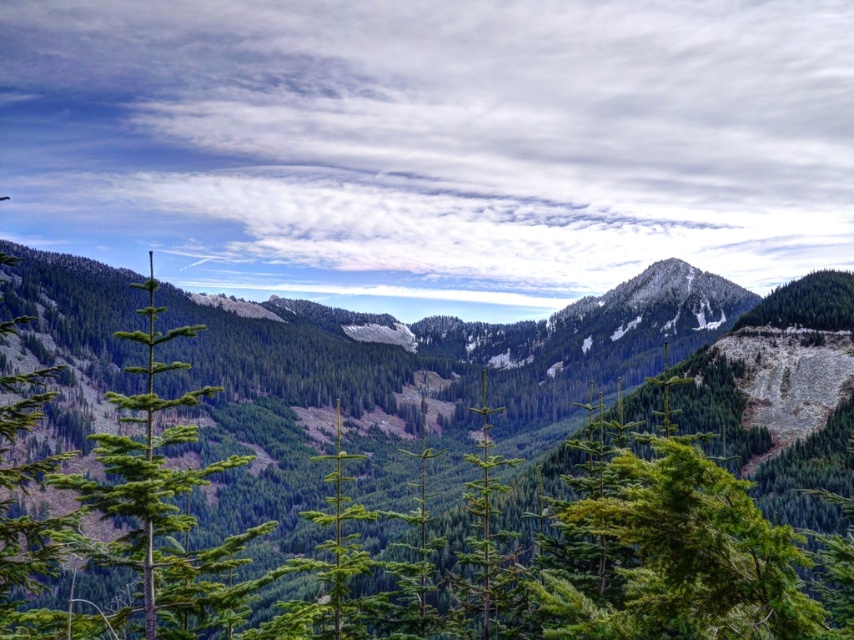
Question: Can you confirm if green matte tree at center is bigger than green needle-like tree at left?

Choices:
 (A) yes
 (B) no

Answer: (B)

Question: Is green matte tree at center to the left of green needle-like tree at left from the viewer's perspective?

Choices:
 (A) yes
 (B) no

Answer: (B)

Question: Which point is farther to the camera?

Choices:
 (A) green needle-like tree at left
 (B) green matte tree at center

Answer: (A)

Question: Which point is closer to the camera?

Choices:
 (A) green matte tree at center
 (B) green needle-like tree at left

Answer: (A)

Question: Can you confirm if green matte tree at center is positioned below green needle-like tree at left?

Choices:
 (A) no
 (B) yes

Answer: (B)